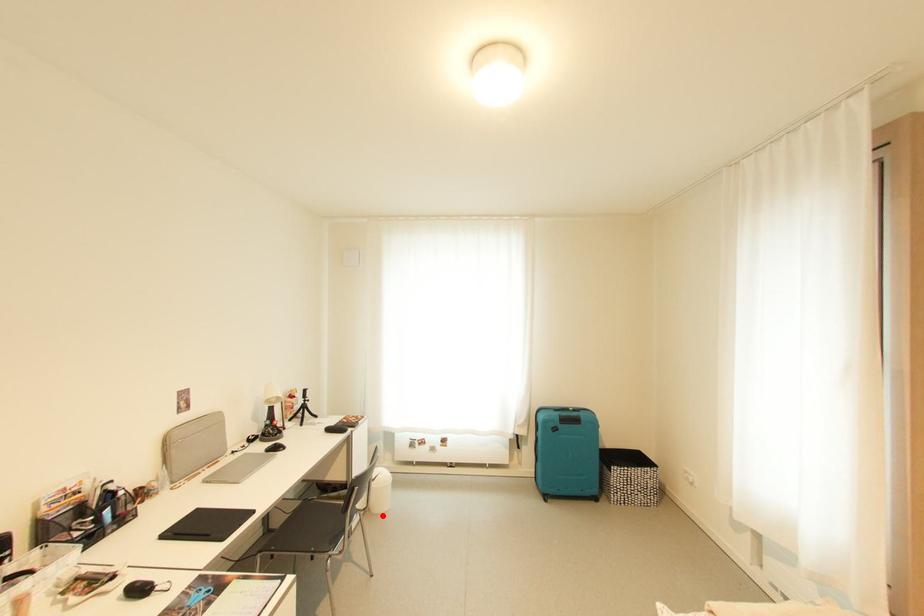
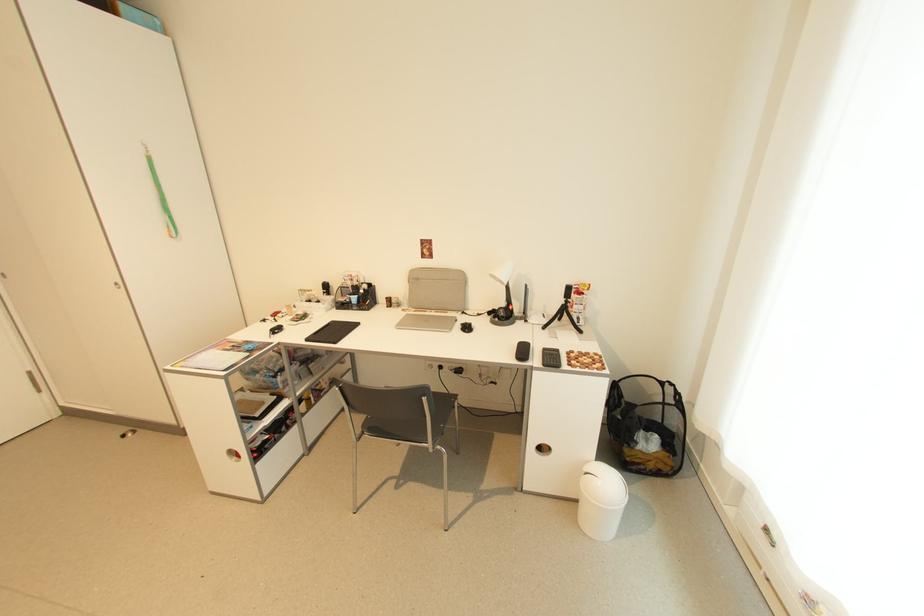
In the second image, find the point that corresponds to the highlighted location in the first image.

(581, 524)